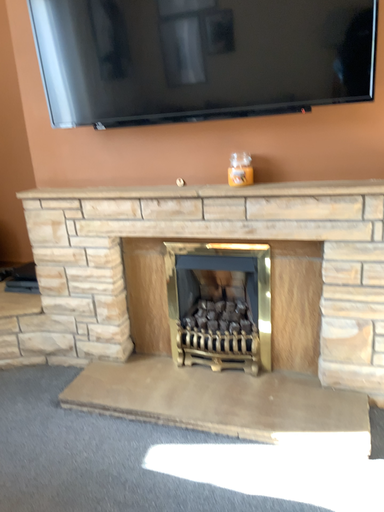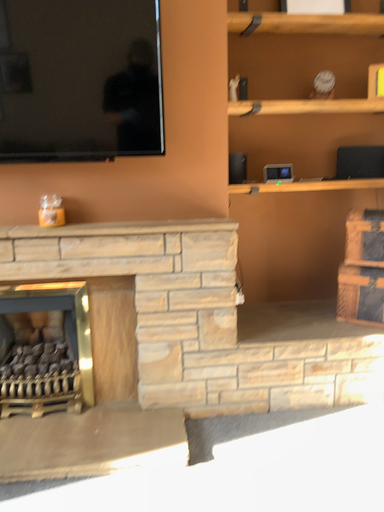
Question: Which way did the camera rotate in the video?

Choices:
 (A) rotated right
 (B) rotated left

Answer: (A)